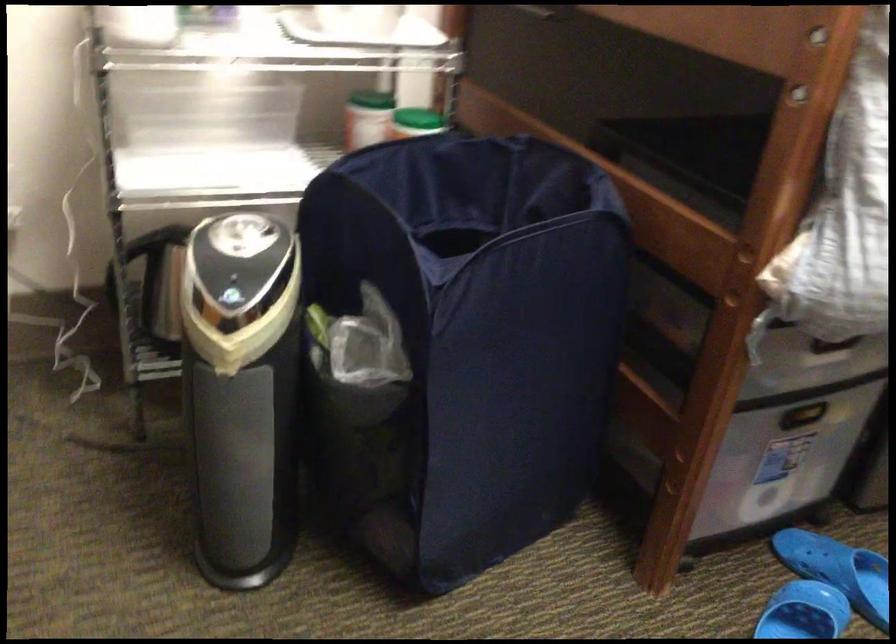
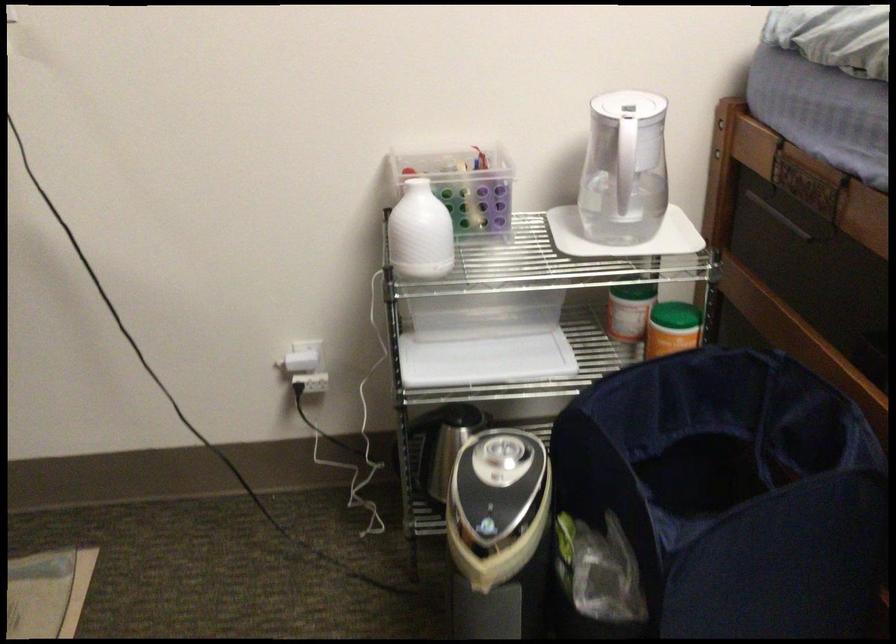
Locate, in the second image, the point that corresponds to point 243,303 in the first image.

(498, 534)